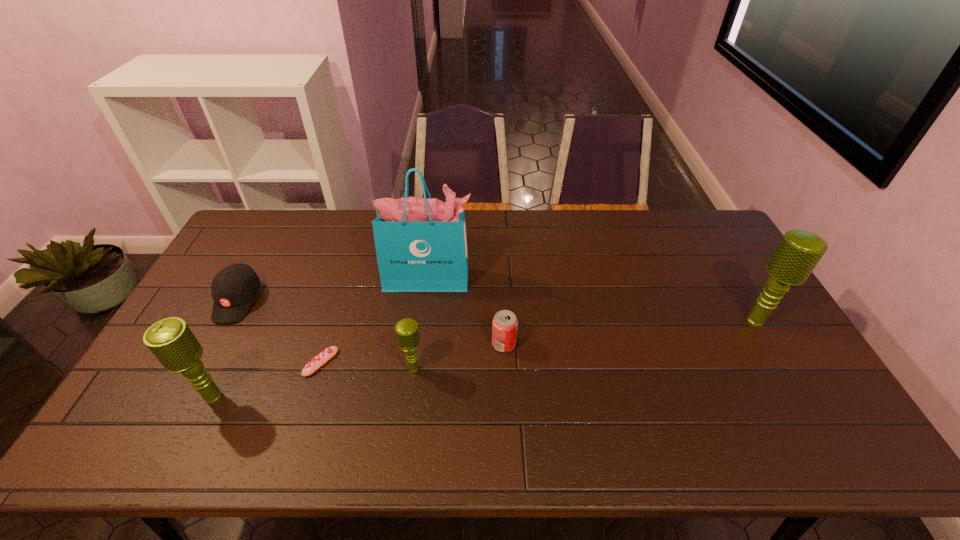
The image size is (960, 540). Identify the location of the nearest object. (171, 341).

Image resolution: width=960 pixels, height=540 pixels. What are the coordinates of `the second shortest microphone` in the screenshot? It's located at (171, 341).

I want to click on the second microphone from left to right, so click(407, 334).

Locate an element on the screen. the second farthest microphone is located at coordinates (407, 334).

Identify the location of the rightmost object. Image resolution: width=960 pixels, height=540 pixels. (798, 253).

Image resolution: width=960 pixels, height=540 pixels. In order to click on the farthest microphone in this screenshot , I will do `click(798, 253)`.

At what (x,y) coordinates should I click in order to perform the action: click on the tallest object. Please return your answer as a coordinate pair (x, y). Looking at the image, I should click on (421, 246).

Find the location of a particular element. the shortest object is located at coordinates (321, 359).

Image resolution: width=960 pixels, height=540 pixels. In order to click on eclair in this screenshot , I will do `click(321, 359)`.

Where is `the second object from right to left`? The height and width of the screenshot is (540, 960). the second object from right to left is located at coordinates (504, 325).